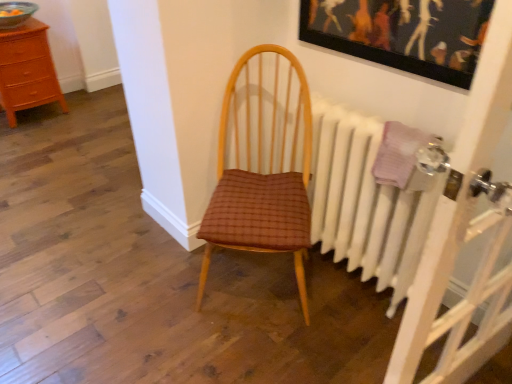
Where is `vacant space to the right of wooden chest of drawers at left`? The height and width of the screenshot is (384, 512). vacant space to the right of wooden chest of drawers at left is located at coordinates (90, 114).